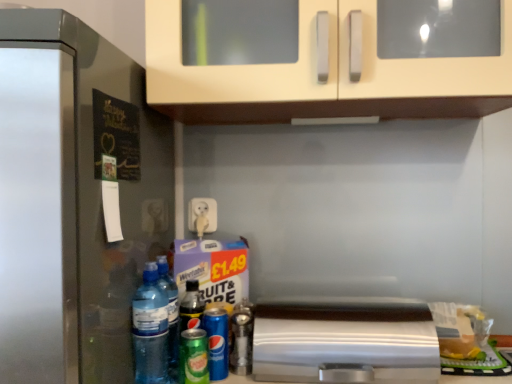
Question: Does satin silver refrigerator at left appear on the right side of satin silver toaster at lower center?

Choices:
 (A) no
 (B) yes

Answer: (A)

Question: Is satin silver refrigerator at left positioned beyond the bounds of satin silver toaster at lower center?

Choices:
 (A) no
 (B) yes

Answer: (B)

Question: Considering the relative positions of satin silver refrigerator at left and satin silver toaster at lower center in the image provided, is satin silver refrigerator at left to the left of satin silver toaster at lower center from the viewer's perspective?

Choices:
 (A) yes
 (B) no

Answer: (A)

Question: Is satin silver toaster at lower center a part of satin silver refrigerator at left?

Choices:
 (A) yes
 (B) no

Answer: (B)

Question: Could you tell me if satin silver refrigerator at left is facing satin silver toaster at lower center?

Choices:
 (A) yes
 (B) no

Answer: (B)

Question: From a real-world perspective, is satin silver refrigerator at left physically below satin silver toaster at lower center?

Choices:
 (A) no
 (B) yes

Answer: (A)

Question: From the image's perspective, is transparent plastic bottle at lower left, positioned as the 2th bottle in right-to-left order, under green matte can at lower center, positioned as the 1th beer in front-to-back order?

Choices:
 (A) no
 (B) yes

Answer: (A)

Question: From a real-world perspective, is transparent plastic bottle at lower left, positioned as the 2th bottle in right-to-left order, below green matte can at lower center, which is the 2th beer in back-to-front order?

Choices:
 (A) no
 (B) yes

Answer: (A)

Question: Is green matte can at lower center, positioned as the 1th beer in front-to-back order, located within transparent plastic bottle at lower left, which is the second bottle from back to front?

Choices:
 (A) yes
 (B) no

Answer: (B)

Question: From the image's perspective, would you say transparent plastic bottle at lower left, positioned as the 2th bottle in right-to-left order, is positioned over green matte can at lower center, positioned as the 1th beer in front-to-back order?

Choices:
 (A) no
 (B) yes

Answer: (B)

Question: Considering the relative sizes of transparent plastic bottle at lower left, positioned as the 2th bottle in right-to-left order, and green matte can at lower center, which is the 2th beer in back-to-front order, in the image provided, is transparent plastic bottle at lower left, positioned as the 2th bottle in right-to-left order, wider than green matte can at lower center, which is the 2th beer in back-to-front order,?

Choices:
 (A) no
 (B) yes

Answer: (B)

Question: Would you consider transparent plastic bottle at lower left, which is the second bottle from back to front, to be distant from green matte can at lower center, which is the 2th beer in back-to-front order?

Choices:
 (A) no
 (B) yes

Answer: (A)

Question: Is translucent plastic water bottle at lower left, the third bottle from the back, to the right of satin silver toaster at lower center from the viewer's perspective?

Choices:
 (A) yes
 (B) no

Answer: (B)